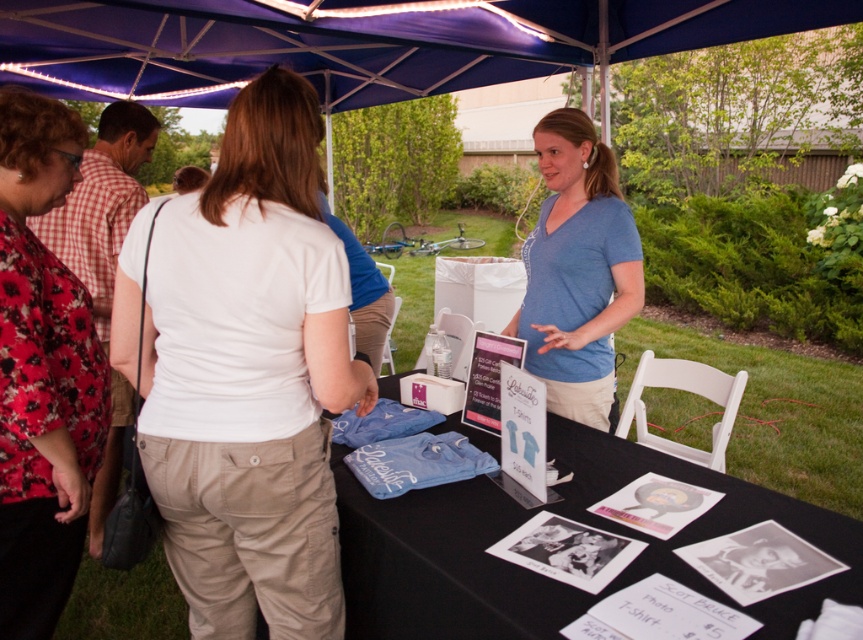
Does white cotton shirt at center have a lesser height compared to blue cotton shirt at center?

No, white cotton shirt at center is not shorter than blue cotton shirt at center.

Does point (208, 209) come in front of point (537, 333)?

That is True.

This screenshot has height=640, width=863. What are the coordinates of `white cotton shirt at center` in the screenshot? It's located at (250, 376).

Between blue fabric canopy at upper center and blue fabric table at center, which one is positioned higher?

Positioned higher is blue fabric canopy at upper center.

Who is positioned more to the right, blue fabric canopy at upper center or blue fabric table at center?

blue fabric table at center

The image size is (863, 640). Describe the element at coordinates (360, 42) in the screenshot. I see `blue fabric canopy at upper center` at that location.

This screenshot has height=640, width=863. Find the location of `blue fabric canopy at upper center`. blue fabric canopy at upper center is located at coordinates (360, 42).

Is blue fabric table at center to the right of floral print blouse at upper left from the viewer's perspective?

Yes, blue fabric table at center is to the right of floral print blouse at upper left.

Does blue fabric table at center have a lesser width compared to floral print blouse at upper left?

No, blue fabric table at center is not thinner than floral print blouse at upper left.

Who is more distant from viewer, (376, 513) or (106, 412)?

Point (106, 412)

Locate an element on the screen. This screenshot has height=640, width=863. blue fabric table at center is located at coordinates (543, 576).